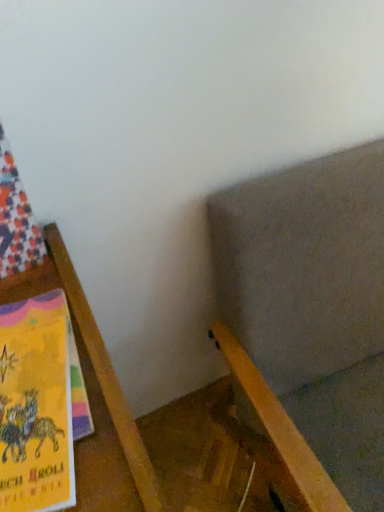
Question: Considering the positions of point (72, 306) and point (352, 401), is point (72, 306) closer or farther from the camera than point (352, 401)?

Choices:
 (A) closer
 (B) farther

Answer: (A)

Question: In terms of height, does wooden bookshelf at left look taller or shorter compared to wooden chair at lower right?

Choices:
 (A) short
 (B) tall

Answer: (A)

Question: Which is correct: wooden bookshelf at left is inside wooden chair at lower right, or outside of it?

Choices:
 (A) outside
 (B) inside

Answer: (A)

Question: Is wooden chair at lower right inside the boundaries of wooden bookshelf at left, or outside?

Choices:
 (A) inside
 (B) outside

Answer: (B)

Question: Based on their sizes in the image, would you say wooden chair at lower right is bigger or smaller than wooden bookshelf at left?

Choices:
 (A) big
 (B) small

Answer: (A)

Question: Relative to wooden bookshelf at left, is wooden chair at lower right in front or behind?

Choices:
 (A) front
 (B) behind

Answer: (B)

Question: Is wooden chair at lower right taller or shorter than wooden bookshelf at left?

Choices:
 (A) short
 (B) tall

Answer: (B)